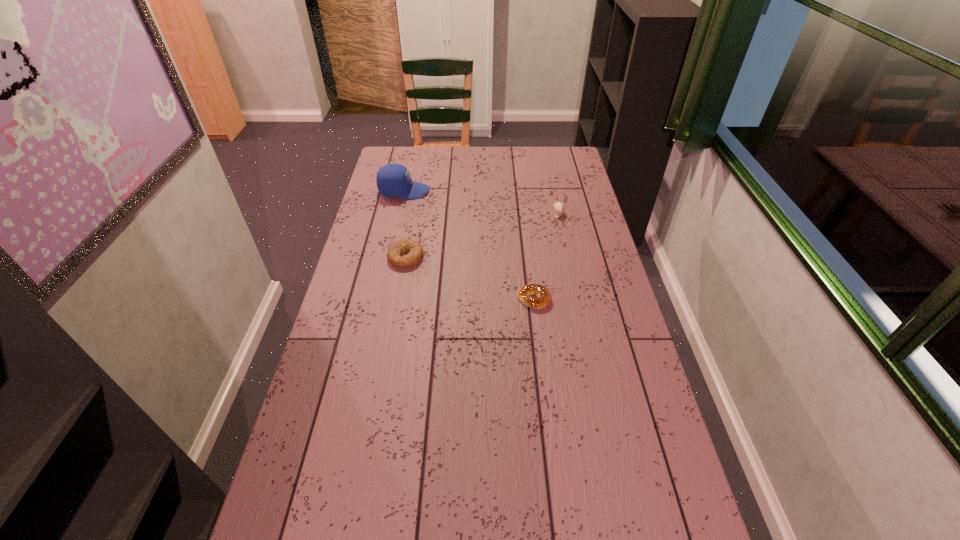
Where is `cap`? This screenshot has width=960, height=540. cap is located at coordinates (393, 180).

Where is `the farthest object`? the farthest object is located at coordinates coord(393,180).

Identify the location of escargot. The width and height of the screenshot is (960, 540). (559, 207).

Identify the location of the rightmost object. (559, 207).

You are a GUI agent. You are given a task and a screenshot of the screen. Output one action in this format:
    pyautogui.click(x=<x>, y=<y>)
    Task: Click on the third farthest object
    
    Given the screenshot: What is the action you would take?
    pyautogui.click(x=394, y=253)

Identify the location of the farther bagel. The image size is (960, 540). (394, 253).

Locate an element on the screen. This screenshot has width=960, height=540. the second object from right to left is located at coordinates (543, 298).

I want to click on the shorter bagel, so [543, 298].

Locate an element on the screen. The width and height of the screenshot is (960, 540). free space located on the front-facing side of the farthest object is located at coordinates (508, 191).

Identify the location of free location located 0.370m on the shell of the escargot. The height and width of the screenshot is (540, 960). (574, 286).